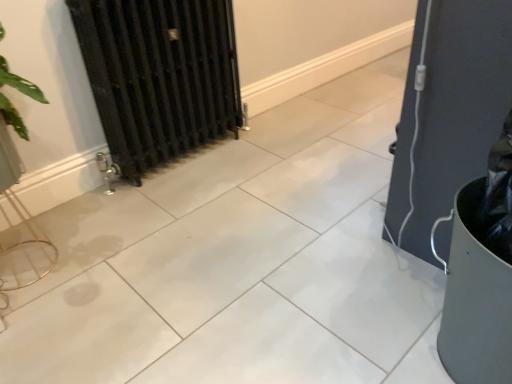
What do you see at coordinates (449, 112) in the screenshot? This screenshot has width=512, height=384. I see `matte black guitar case at right` at bounding box center [449, 112].

Find the location of a particular element. This screenshot has width=512, height=384. matte black guitar case at right is located at coordinates (449, 112).

What do you see at coordinates (159, 76) in the screenshot? I see `black metal radiator at left` at bounding box center [159, 76].

Where is `black metal radiator at left`? This screenshot has height=384, width=512. black metal radiator at left is located at coordinates (159, 76).

At what (x,y) coordinates should I click in order to perform the action: click on matte black guitar case at right. Please return your answer as a coordinate pair (x, y). The height and width of the screenshot is (384, 512). Looking at the image, I should click on (449, 112).

Visually, is black metal radiator at left positioned to the left or to the right of matte black guitar case at right?

black metal radiator at left is positioned on matte black guitar case at right's left side.

Which is in front, black metal radiator at left or matte black guitar case at right?

matte black guitar case at right is more forward.

Which is in front, point (131, 95) or point (430, 16)?

Point (430, 16)

From the image's perspective, is black metal radiator at left over matte black guitar case at right?

Yes, from the image's perspective, black metal radiator at left is above matte black guitar case at right.

From a real-world perspective, between black metal radiator at left and matte black guitar case at right, who is vertically higher?

In real-world perspective, black metal radiator at left is above.

Which of these two, black metal radiator at left or matte black guitar case at right, is wider?

With larger width is matte black guitar case at right.

Who is shorter, black metal radiator at left or matte black guitar case at right?

Standing shorter between the two is matte black guitar case at right.

Does black metal radiator at left have a smaller size compared to matte black guitar case at right?

Actually, black metal radiator at left might be larger than matte black guitar case at right.

Is black metal radiator at left completely or partially outside of matte black guitar case at right?

Indeed, black metal radiator at left is completely outside matte black guitar case at right.

Are black metal radiator at left and matte black guitar case at right far apart?

Indeed, black metal radiator at left is not near matte black guitar case at right.

Is black metal radiator at left aimed at matte black guitar case at right?

Yes.

What's the angular difference between black metal radiator at left and matte black guitar case at right's facing directions?

black metal radiator at left and matte black guitar case at right are facing 179 degrees away from each other.

Measure the distance between black metal radiator at left and matte black guitar case at right.

black metal radiator at left and matte black guitar case at right are 1.03 meters apart from each other.

Where is `radiator on the left of matte black guitar case at right`? radiator on the left of matte black guitar case at right is located at coordinates (159, 76).

Considering the positions of objects matte black guitar case at right and black metal radiator at left in the image provided, who is more to the right, matte black guitar case at right or black metal radiator at left?

matte black guitar case at right is more to the right.

Which object is further away from the camera, matte black guitar case at right or black metal radiator at left?

Positioned behind is black metal radiator at left.

Is point (412, 107) more distant than point (215, 136)?

No, (412, 107) is closer to viewer.

From the image's perspective, which object appears higher, matte black guitar case at right or black metal radiator at left?

black metal radiator at left.

From a real-world perspective, is matte black guitar case at right over black metal radiator at left?

No.

Considering the sizes of objects matte black guitar case at right and black metal radiator at left in the image provided, who is thinner, matte black guitar case at right or black metal radiator at left?

black metal radiator at left.

Considering the sizes of objects matte black guitar case at right and black metal radiator at left in the image provided, who is taller, matte black guitar case at right or black metal radiator at left?

With more height is black metal radiator at left.

Which of these two, matte black guitar case at right or black metal radiator at left, is bigger?

black metal radiator at left.

Would you say matte black guitar case at right contains black metal radiator at left?

Definitely not — black metal radiator at left is not inside matte black guitar case at right.

Is matte black guitar case at right in contact with black metal radiator at left?

No, matte black guitar case at right is not in contact with black metal radiator at left.

Looking at this image, is matte black guitar case at right turned away from black metal radiator at left?

No, matte black guitar case at right's orientation is not away from black metal radiator at left.

At what (x,y) coordinates should I click in order to perform the action: click on radiator above the matte black guitar case at right (from a real-world perspective). Please return your answer as a coordinate pair (x, y). This screenshot has width=512, height=384. Looking at the image, I should click on (159, 76).

At what (x,y) coordinates should I click in order to perform the action: click on radiator that appears behind the matte black guitar case at right. Please return your answer as a coordinate pair (x, y). The image size is (512, 384). Looking at the image, I should click on tap(159, 76).

In order to click on radiator above the matte black guitar case at right (from the image's perspective) in this screenshot , I will do `click(159, 76)`.